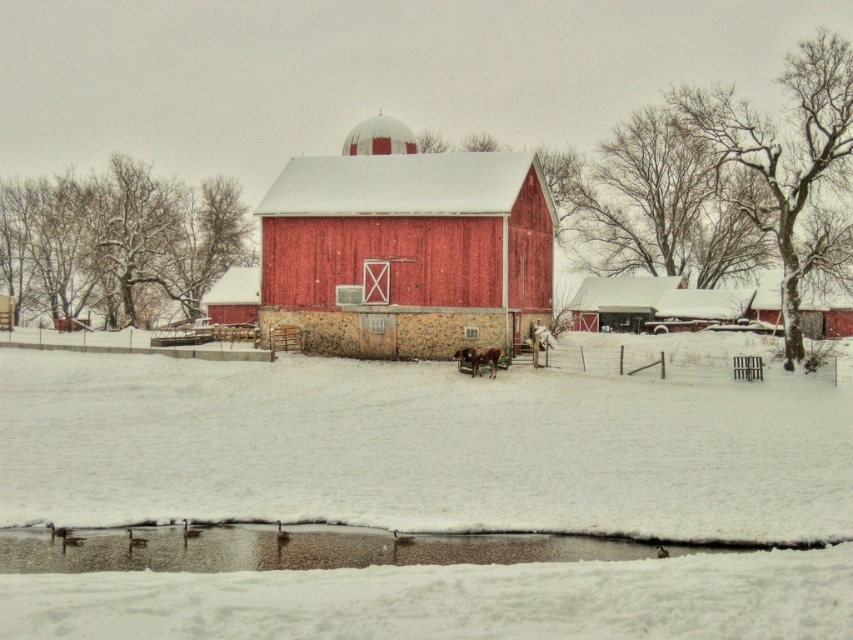
You are a farmer who needs to cross from the barn to the muddy puddle to check the water quality. Given that your tractor has a turning radius of 15 feet, can you navigate your tractor directly from the matte wood barn at center to the brown muddy puddle at lower center without making any turns?

The matte wood barn at center and brown muddy puddle at lower center are 122.00 feet apart. Since the tractor has a turning radius of 15 feet, it can move in a straight line between them without needing to turn, so yes, the farmer can navigate directly without making any turns.

You are standing at the point where the coordinates are (419, 445). Looking around, you see the traditional red barn with a white roof and a silo on top. What is directly beneath your feet at this location?

The white fluffy snow at center is directly beneath your feet at point (419, 445).

You are a farmer checking the height of your animals and structures. You have a ladder that can reach up to 2 meters. You need to clean the roof of the matte wood barn at center and also check the height of the brown fuzzy cow at center. Which one can you reach with your ladder?

The matte wood barn at center is much taller than the brown fuzzy cow at center. Since the ladder can reach up to 2 meters, it can be used to clean the roof of the matte wood barn at center if its height is within the ladder reach. However, the brown fuzzy cow at center is shorter, so the ladder is unnecessary for checking its height.